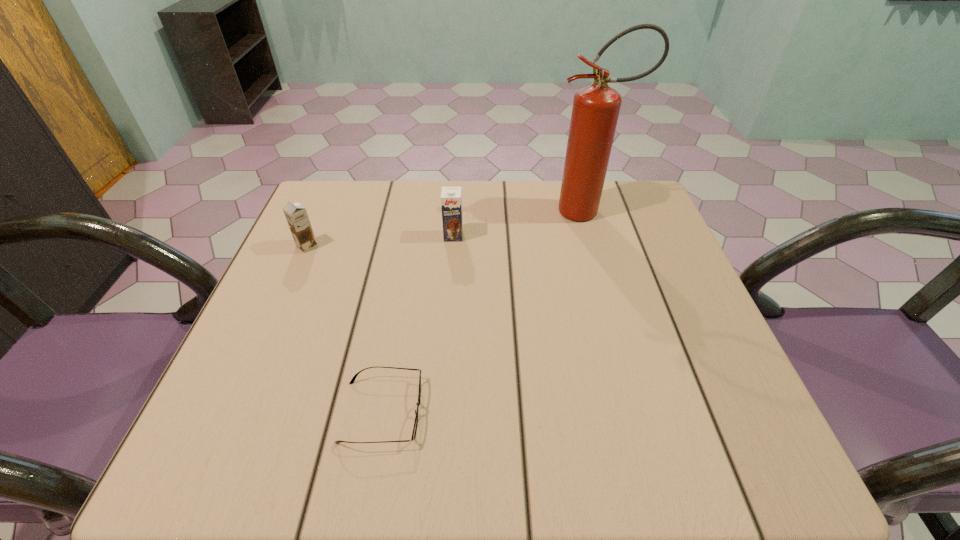
At what (x,y) coordinates should I click in order to perform the action: click on unoccupied position between the second object from left to right and the leftmost object. Please return your answer as a coordinate pair (x, y). The image size is (960, 540). Looking at the image, I should click on (345, 329).

At what (x,y) coordinates should I click in order to perform the action: click on free space between the leftmost object and the third object from left to right. Please return your answer as a coordinate pair (x, y). Looking at the image, I should click on click(380, 241).

This screenshot has height=540, width=960. Find the location of `free space between the shortest object and the left chocolate milk`. free space between the shortest object and the left chocolate milk is located at coordinates (345, 329).

Identify which object is the second closest to the third object from left to right. Please provide its 2D coordinates. Your answer should be formatted as a tuple, i.e. [(x, y)], where the tuple contains the x and y coordinates of a point satisfying the conditions above.

[(296, 215)]

In order to click on object that can be found as the closest to the rightmost object in this screenshot , I will do `click(451, 199)`.

Locate an element on the screen. This screenshot has width=960, height=540. blank space that satisfies the following two spatial constraints: 1. from the nozzle of the tallest object; 2. on the front side of the leftmost object is located at coordinates [598, 246].

At what (x,y) coordinates should I click in order to perform the action: click on vacant position in the image that satisfies the following two spatial constraints: 1. from the nozzle of the fire extinguisher; 2. on the front label of the third object from left to right. Please return your answer as a coordinate pair (x, y). The width and height of the screenshot is (960, 540). Looking at the image, I should click on (595, 236).

Identify the location of vacant space that satisfies the following two spatial constraints: 1. from the nozzle of the farthest object; 2. on the front label of the third object from left to right. click(595, 236).

This screenshot has height=540, width=960. What are the coordinates of `free space that satisfies the following two spatial constraints: 1. on the front label of the right chocolate milk; 2. on the front-facing side of the shortest object` in the screenshot? It's located at (442, 411).